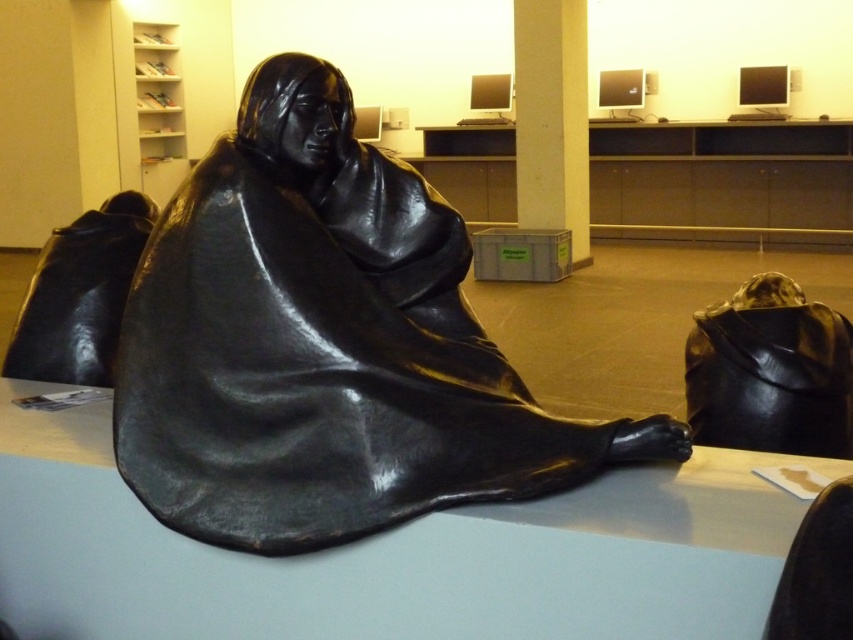
Does shiny black statue at center have a larger size compared to white matte pillar at upper center?

No.

Can you confirm if shiny black statue at center is positioned above white matte pillar at upper center?

No, shiny black statue at center is not above white matte pillar at upper center.

Does point (254, 138) lie in front of point (527, 32)?

Yes, it is.

Locate an element on the screen. This screenshot has width=853, height=640. shiny black statue at center is located at coordinates (325, 346).

Which is below, glossy black table at center or white matte pillar at upper center?

Positioned lower is glossy black table at center.

Which is in front, point (729, 552) or point (548, 4)?

Positioned in front is point (729, 552).

The image size is (853, 640). I want to click on glossy black table at center, so click(x=392, y=554).

From the picture: Can you confirm if shiny black statue at center is shorter than glossy black table at center?

In fact, shiny black statue at center may be taller than glossy black table at center.

Which is in front, point (373, 476) or point (349, 630)?

Point (373, 476) is in front.

The width and height of the screenshot is (853, 640). Describe the element at coordinates (325, 346) in the screenshot. I see `shiny black statue at center` at that location.

Locate an element on the screen. This screenshot has height=640, width=853. shiny black statue at center is located at coordinates (325, 346).